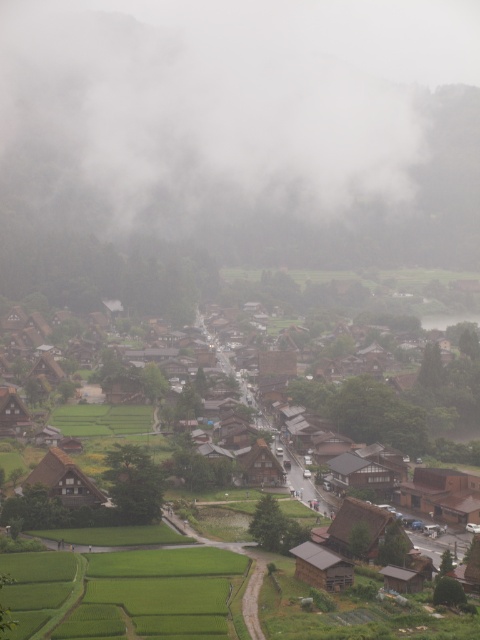
Looking at this image, who is lower down, dark brown wooden hut at center or brown wooden hut at lower left?

Positioned lower is dark brown wooden hut at center.

Is point (337, 461) positioned behind point (21, 401)?

No, (337, 461) is closer to viewer.

Where is `dark brown wooden hut at center`? Image resolution: width=480 pixels, height=640 pixels. dark brown wooden hut at center is located at coordinates (360, 474).

Does brown wooden houses at center appear on the right side of brown wooden hut at center?

Yes, brown wooden houses at center is to the right of brown wooden hut at center.

Is point (478, 461) positioned after point (257, 444)?

Yes.

I want to click on brown wooden houses at center, so click(398, 404).

Which is behind, point (153, 173) or point (259, 472)?

The point (153, 173) is more distant.

Does white mist at upper center have a lesser height compared to brown wooden hut at center?

No.

Which is in front, point (351, 83) or point (278, 472)?

Point (278, 472) is more forward.

I want to click on white mist at upper center, so [x=250, y=124].